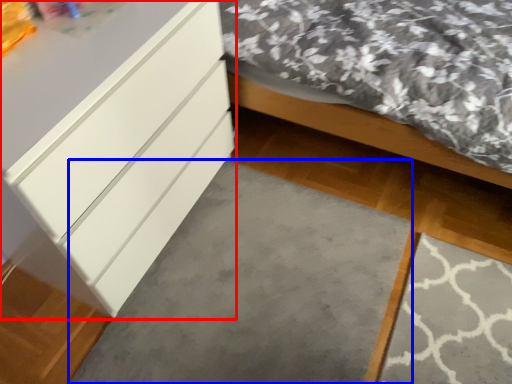
Question: Which object appears closest to the camera in this image, chest of drawers (highlighted by a red box) or concrete (highlighted by a blue box)?

Choices:
 (A) chest of drawers
 (B) concrete

Answer: (A)